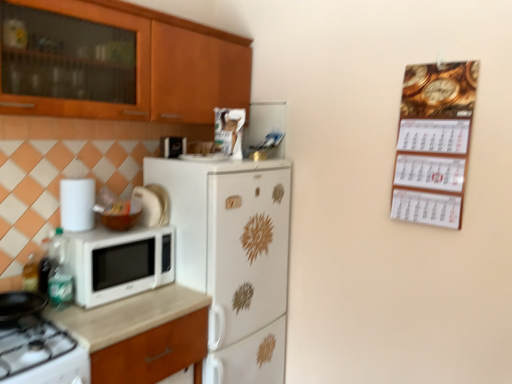
Question: In the image, is white glossy refrigerator at center positioned in front of or behind white matte microwave at left?

Choices:
 (A) behind
 (B) front

Answer: (A)

Question: From the image's perspective, is white glossy refrigerator at center positioned above or below white matte microwave at left?

Choices:
 (A) above
 (B) below

Answer: (B)

Question: Estimate the real-world distances between objects in this image. Which object is closer to the white matte microwave at left?

Choices:
 (A) wooden cabinet at upper left
 (B) white glossy refrigerator at center
 (C) white glossy microwave at left, the second appliance from the back
 (D) beige laminate countertop at lower left
 (E) gold metallic calendar at upper right

Answer: (D)

Question: Estimate the real-world distances between objects in this image. Which object is closer to the white glossy microwave at left, arranged as the second appliance when viewed from the right?

Choices:
 (A) metallic silver microwave at upper center, placed as the 3th appliance when sorted from left to right
 (B) white glossy refrigerator at center
 (C) white glossy gas stove at lower left
 (D) white matte microwave at left
 (E) gold metallic calendar at upper right

Answer: (D)